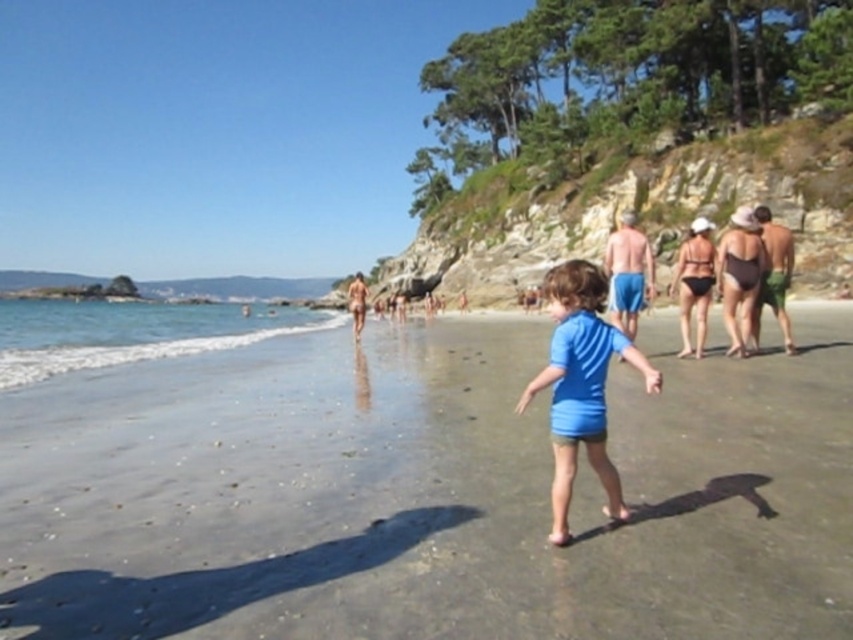
You are standing at the point marked as point [581,385]. What object is located exactly at this point?

The blue matte shirt at center is located exactly at point [581,385].

You are a photographer trying to capture both the blue matte shirt at center and the matte pink bikini at center in one shot. Which object should you focus on first to ensure both are in frame?

You should focus on the blue matte shirt at center first because it is smaller than the matte pink bikini at center, so adjusting the camera to include the smaller object ensures the larger one will also be captured.